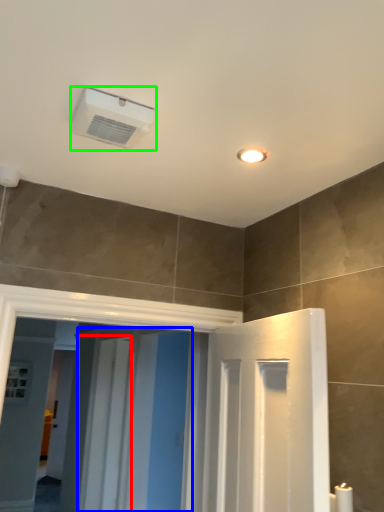
Question: Based on their relative distances, which object is nearer to screen door (highlighted by a red box)? Choose from screen door (highlighted by a blue box) and air conditioning (highlighted by a green box).

Choices:
 (A) screen door
 (B) air conditioning

Answer: (A)